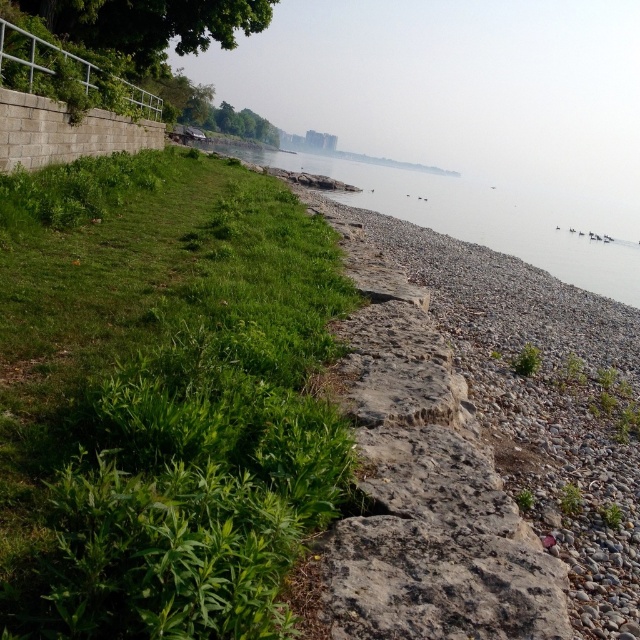
Question: Which point is farther from the camera taking this photo?

Choices:
 (A) (124, 44)
 (B) (604, 282)

Answer: (B)

Question: Which point is closer to the camera?

Choices:
 (A) (243, 13)
 (B) (442, 227)

Answer: (A)

Question: Does gray gravel water at lower right appear over green leafy tree at upper left?

Choices:
 (A) no
 (B) yes

Answer: (B)

Question: Can you confirm if gray gravel water at lower right is smaller than green leafy tree at upper left?

Choices:
 (A) yes
 (B) no

Answer: (B)

Question: Does gray gravel water at lower right appear under green leafy tree at upper left?

Choices:
 (A) no
 (B) yes

Answer: (A)